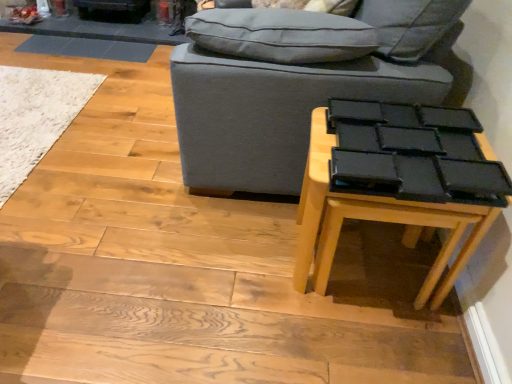
Question: Looking at their shapes, would you say black matte table at lower right is wider or thinner than gray fabric studio couch at center?

Choices:
 (A) thin
 (B) wide

Answer: (A)

Question: Considering the positions of point (407, 238) and point (310, 28), is point (407, 238) closer or farther from the camera than point (310, 28)?

Choices:
 (A) farther
 (B) closer

Answer: (A)

Question: Which of these objects is positioned closest to the white shaggy rug at lower left?

Choices:
 (A) black matte table at lower right
 (B) gray fabric studio couch at center

Answer: (B)

Question: Which object is the farthest from the gray fabric studio couch at center?

Choices:
 (A) black matte table at lower right
 (B) white shaggy rug at lower left

Answer: (B)